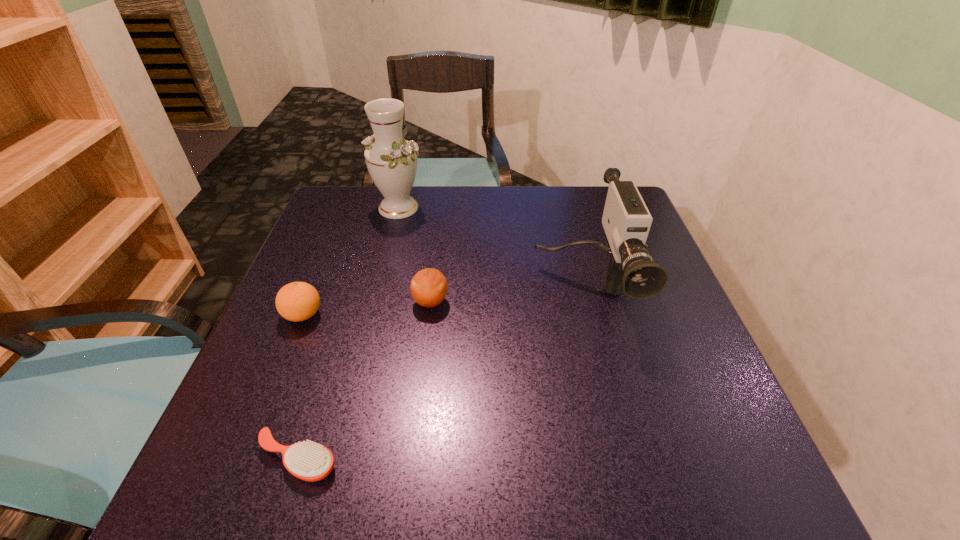
This screenshot has height=540, width=960. What are the coordinates of `free spot located on the right of the fourth object from left to right` in the screenshot? It's located at (471, 302).

I want to click on vacant space located 0.100m on the right of the left orange, so click(371, 315).

Where is `free space located 0.260m on the back of the nearest object`? The height and width of the screenshot is (540, 960). free space located 0.260m on the back of the nearest object is located at coordinates (343, 318).

The height and width of the screenshot is (540, 960). I want to click on object that is positioned at the far edge, so [391, 160].

The image size is (960, 540). In order to click on object located in the near edge section of the desktop in this screenshot , I will do `click(309, 461)`.

You are a GUI agent. You are given a task and a screenshot of the screen. Output one action in this format:
    pyautogui.click(x=<x>, y=<y>)
    Task: Click on the vase that is at the left edge
    
    Given the screenshot: What is the action you would take?
    pyautogui.click(x=391, y=160)

The image size is (960, 540). In order to click on orange present at the left edge in this screenshot , I will do `click(297, 301)`.

At what (x,y) coordinates should I click in order to perform the action: click on hairbrush present at the left edge. Please return your answer as a coordinate pair (x, y). Looking at the image, I should click on (309, 461).

Find the location of a particular element. object at the right edge is located at coordinates (626, 220).

You are a GUI agent. You are given a task and a screenshot of the screen. Output one action in this format:
    pyautogui.click(x=<x>, y=<y>)
    Task: Click on the object positioned at the far left corner
    This screenshot has height=540, width=960.
    Given the screenshot: What is the action you would take?
    pyautogui.click(x=391, y=160)